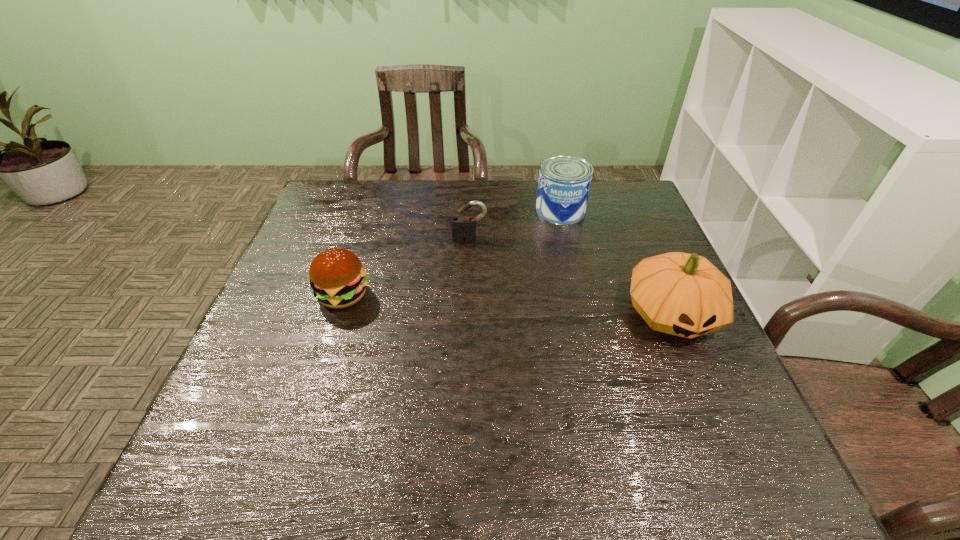
Identify the location of vacant area at the left edge of the desktop. (305, 301).

Find the location of a particular element. The width and height of the screenshot is (960, 540). vacant area at the right edge of the desktop is located at coordinates (616, 230).

At what (x,y) coordinates should I click in order to perform the action: click on empty space that is in between the second object from right to left and the rightmost object. Please return your answer as a coordinate pair (x, y). This screenshot has height=540, width=960. Looking at the image, I should click on (616, 262).

Find the location of a particular element. The image size is (960, 540). vacant region between the can and the third nearest object is located at coordinates tap(515, 225).

Where is `vacant space that is in between the hamburger and the tallest object`? This screenshot has width=960, height=540. vacant space that is in between the hamburger and the tallest object is located at coordinates (507, 305).

At what (x,y) coordinates should I click in order to perform the action: click on free spot between the second object from left to right and the tallest object. Please return your answer as a coordinate pair (x, y). The image size is (960, 540). Looking at the image, I should click on (570, 276).

You are a GUI agent. You are given a task and a screenshot of the screen. Output one action in this format:
    pyautogui.click(x=<x>, y=<y>)
    Task: Click on the empty location between the leftmost object and the second object from left to right
    This screenshot has height=540, width=960.
    Given the screenshot: What is the action you would take?
    pyautogui.click(x=406, y=267)

Locate an element on the screen. This screenshot has width=960, height=540. free point between the third object from left to right and the tallest object is located at coordinates (616, 262).

You are a GUI agent. You are given a task and a screenshot of the screen. Output one action in this format:
    pyautogui.click(x=<x>, y=<y>)
    Task: Click on the free space between the second object from right to left and the tallest object
    
    Given the screenshot: What is the action you would take?
    click(616, 262)

Find the location of a particular element. This screenshot has width=960, height=540. free space between the rightmost object and the second tallest object is located at coordinates point(616,262).